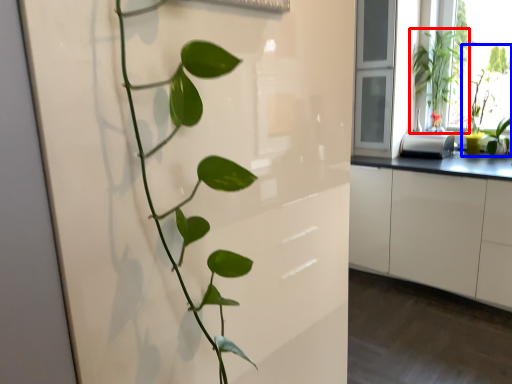
Question: Which object appears farthest to the camera in this image, houseplant (highlighted by a red box) or houseplant (highlighted by a blue box)?

Choices:
 (A) houseplant
 (B) houseplant

Answer: (A)